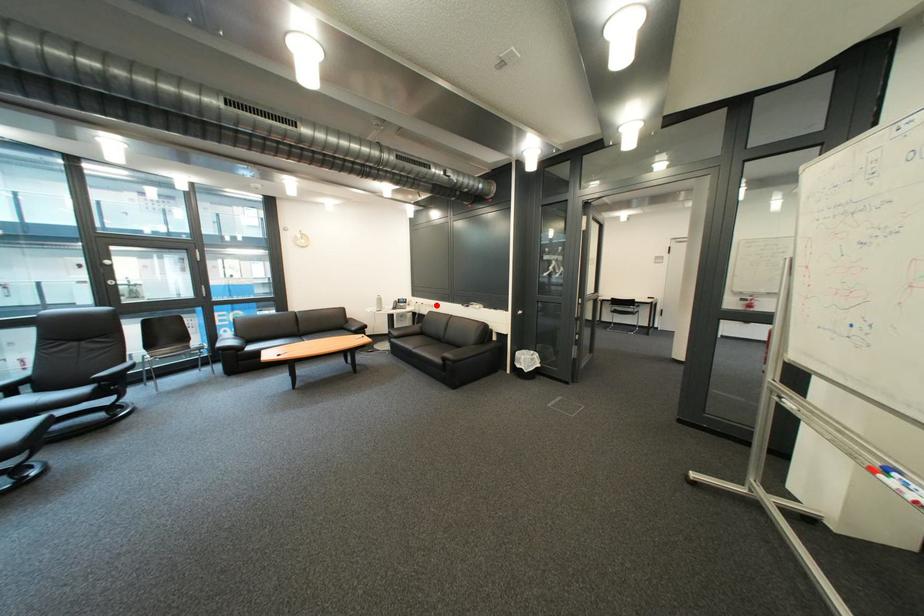
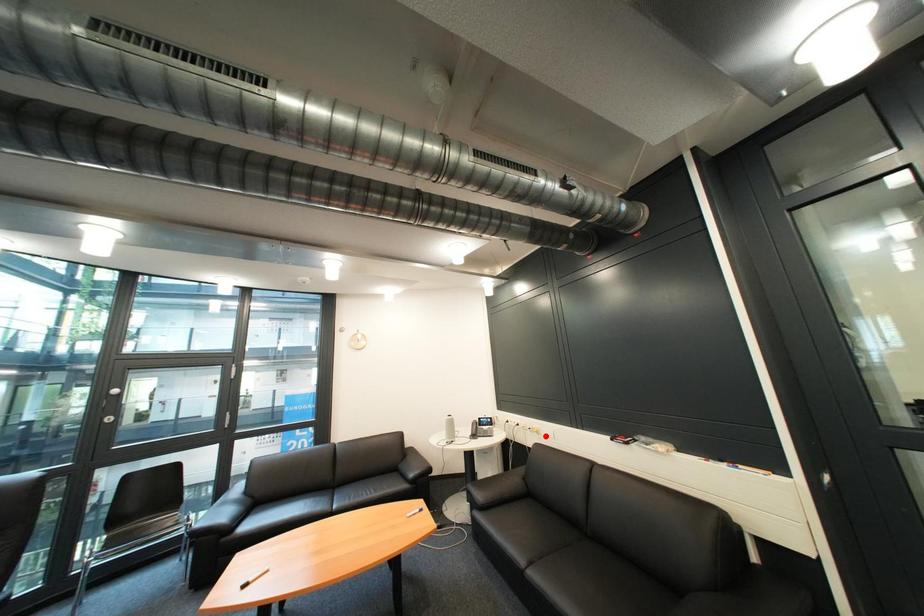
I am providing you with two images of the same scene from different viewpoints. A red point is marked on the first image and another point is marked on the second image. Do the highlighted points in image1 and image2 indicate the same real-world spot?

No